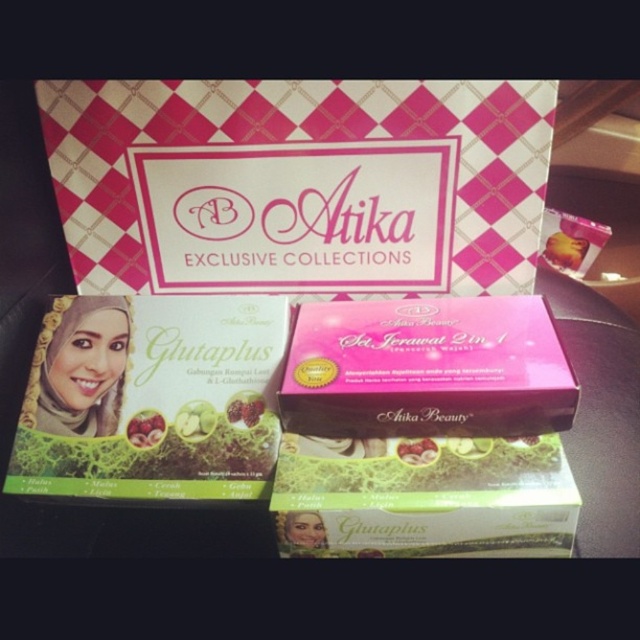
Question: Does green matte glutaplus box at lower left lie in front of pink matte box at upper center?

Choices:
 (A) no
 (B) yes

Answer: (B)

Question: Which object appears farthest from the camera in this image?

Choices:
 (A) pink matte box at upper center
 (B) pink matte box at center

Answer: (A)

Question: Which point is closer to the camera?

Choices:
 (A) (602, 230)
 (B) (500, 452)
 (C) (476, 326)
 (D) (193, 422)

Answer: (B)

Question: Is green matte glutaplus box at lower left bigger than pink matte box at upper center?

Choices:
 (A) no
 (B) yes

Answer: (B)

Question: In this image, where is green matte glutaplus box at lower left located relative to pink matte box at center?

Choices:
 (A) right
 (B) left

Answer: (B)

Question: Which object is the farthest from the pink matte box at center?

Choices:
 (A) green matte glutaplus box at lower left
 (B) pink matte box at upper center

Answer: (B)